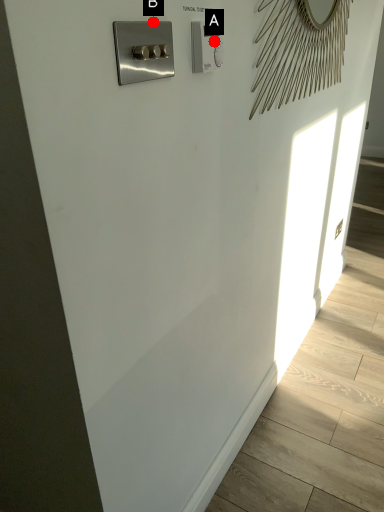
Question: Two points are circled on the image, labeled by A and B beside each circle. Among these points, which one is farthest from the camera?

Choices:
 (A) A is further
 (B) B is further

Answer: (A)